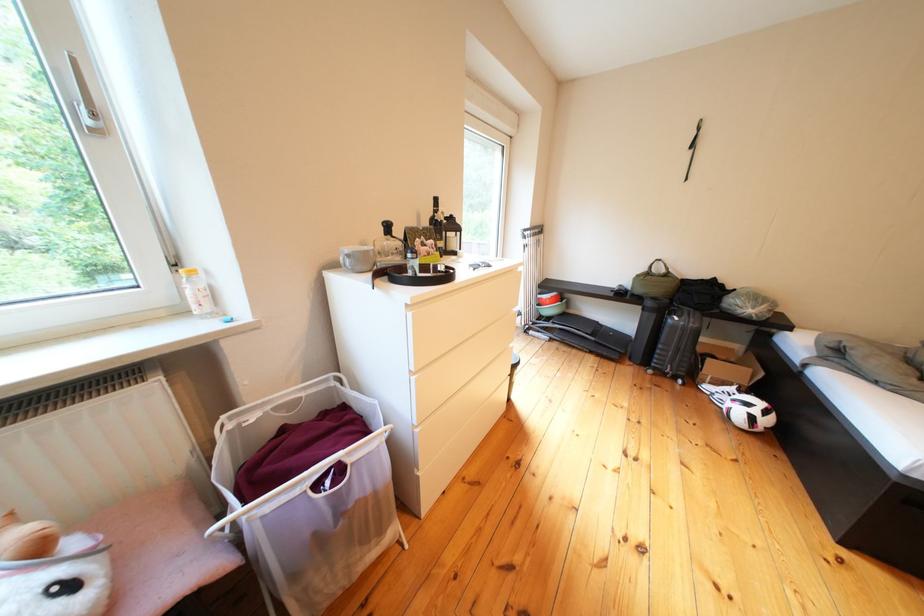
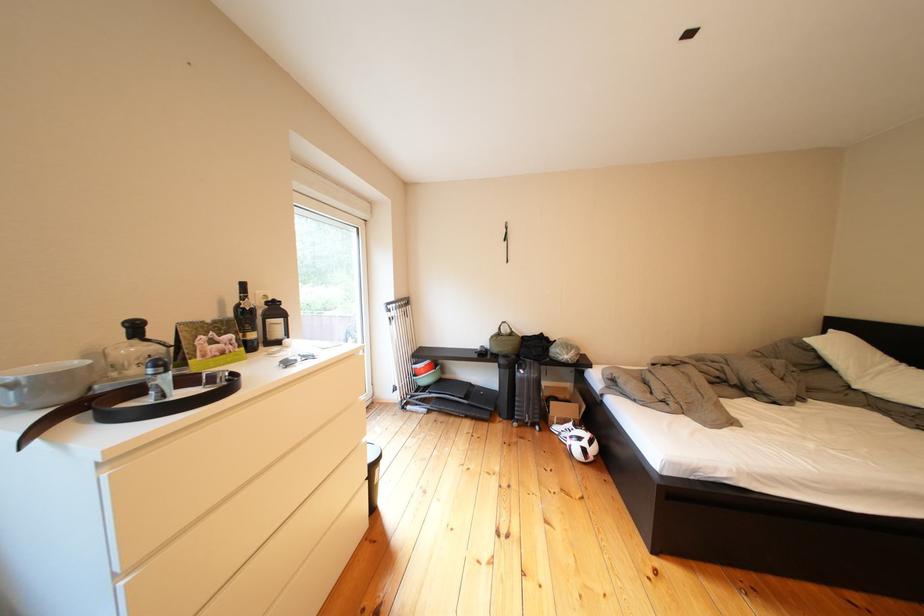
Find the pixel in the second image that matches [403,241] in the first image.

(150, 345)